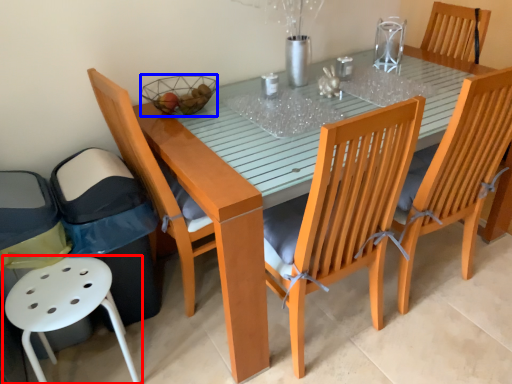
Question: Which object is closer to the camera taking this photo, chair (highlighted by a red box) or basket (highlighted by a blue box)?

Choices:
 (A) chair
 (B) basket

Answer: (A)